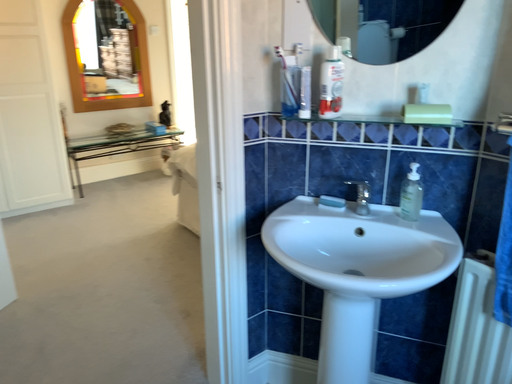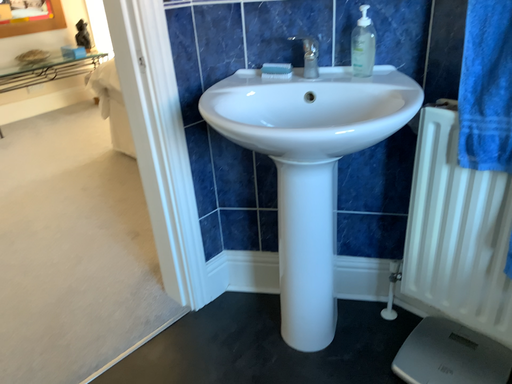
Question: How did the camera likely rotate when shooting the video?

Choices:
 (A) rotated downward
 (B) rotated upward

Answer: (A)